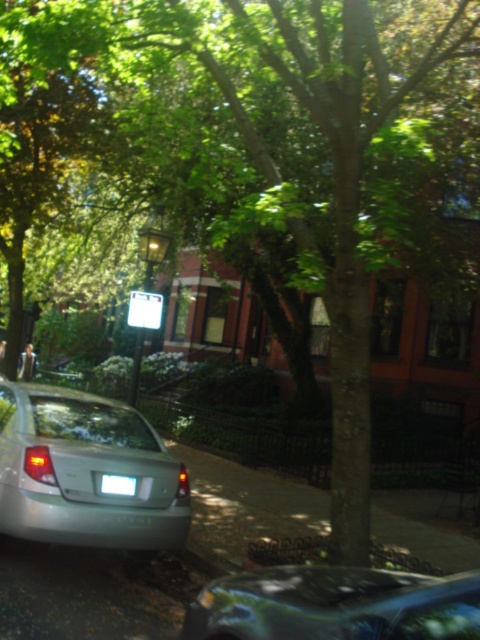
Is metallic blue car at lower center taller than white plastic license plate at lower center?

Indeed, metallic blue car at lower center has a greater height compared to white plastic license plate at lower center.

Does metallic blue car at lower center have a lesser width compared to white plastic license plate at lower center?

No, metallic blue car at lower center is not thinner than white plastic license plate at lower center.

What do you see at coordinates (335, 605) in the screenshot? This screenshot has height=640, width=480. I see `metallic blue car at lower center` at bounding box center [335, 605].

This screenshot has height=640, width=480. What are the coordinates of `metallic blue car at lower center` in the screenshot? It's located at (335, 605).

Does satin silver sedan at center appear on the right side of metallic blue car at lower center?

No, satin silver sedan at center is not to the right of metallic blue car at lower center.

Can you confirm if satin silver sedan at center is positioned above metallic blue car at lower center?

Yes, satin silver sedan at center is above metallic blue car at lower center.

This screenshot has height=640, width=480. I want to click on satin silver sedan at center, so click(x=85, y=472).

Where is `satin silver sedan at center`? This screenshot has height=640, width=480. satin silver sedan at center is located at coordinates (85, 472).

Who is more distant from viewer, [56,541] or [115,483]?

Positioned behind is point [115,483].

Does point (96, 531) come behind point (123, 483)?

No, it is in front of (123, 483).

The height and width of the screenshot is (640, 480). What are the coordinates of `satin silver sedan at center` in the screenshot? It's located at (85, 472).